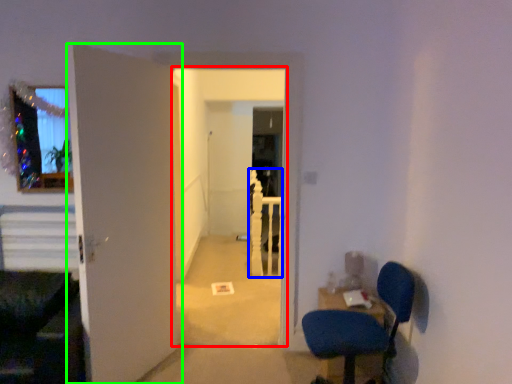
Question: Which is farther away from corridor (highlighted by a red box)? rail (highlighted by a blue box) or door (highlighted by a green box)?

Choices:
 (A) rail
 (B) door

Answer: (B)